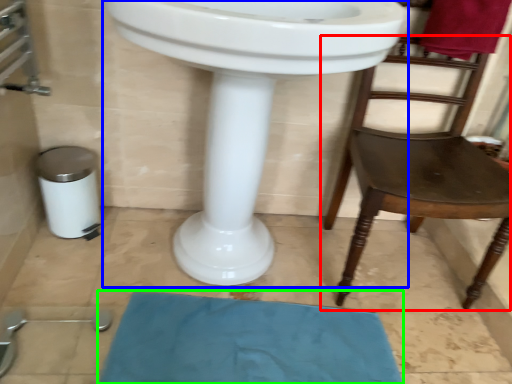
Question: Estimate the real-world distances between objects in this image. Which object is farther from chair (highlighted by a red box), sink (highlighted by a blue box) or bath mat (highlighted by a green box)?

Choices:
 (A) sink
 (B) bath mat

Answer: (B)